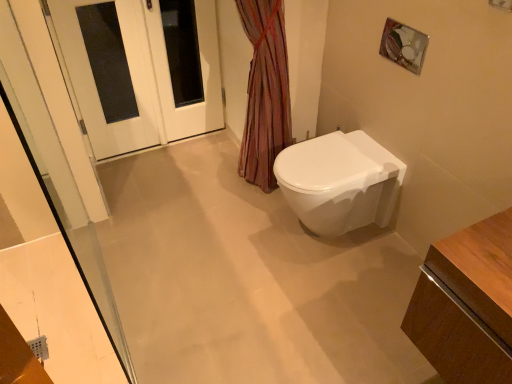
The image size is (512, 384). I want to click on free spot above white glossy toilet at center-right (from a real-world perspective), so click(x=328, y=158).